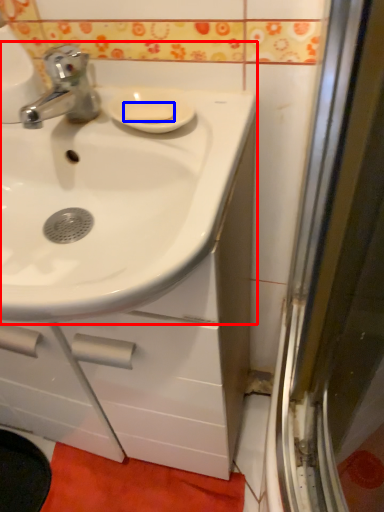
Question: Which point is closer to the camera, sink (highlighted by a red box) or soap (highlighted by a blue box)?

Choices:
 (A) sink
 (B) soap

Answer: (A)